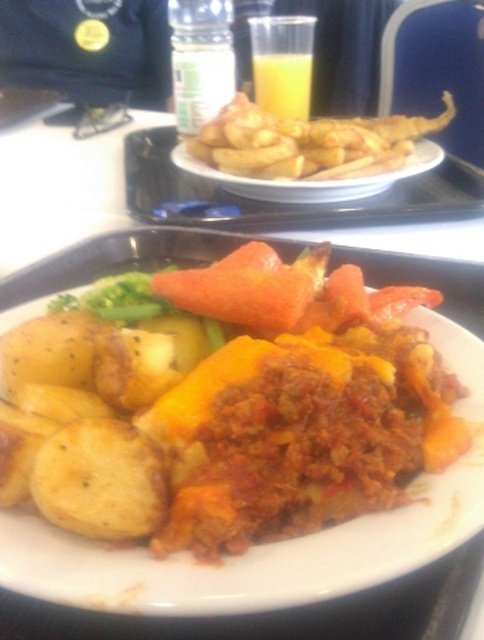
Question: Which object is positioned farthest from the orange smooth carrot at center?

Choices:
 (A) golden crispy fries at upper center
 (B) yellow matte potatoes at lower left

Answer: (A)

Question: Is golden crispy fries at upper center smaller than translucent plastic cup at upper center?

Choices:
 (A) yes
 (B) no

Answer: (B)

Question: Which object is farther from the camera taking this photo?

Choices:
 (A) translucent plastic cup at upper center
 (B) yellow matte potatoes at lower left
 (C) golden crispy fries at upper center
 (D) yellow matte potato at lower left

Answer: (A)

Question: Is golden crispy fries at upper center bigger than yellow matte potato at lower left?

Choices:
 (A) no
 (B) yes

Answer: (B)

Question: Among these points, which one is farthest from the camera?

Choices:
 (A) click(141, 529)
 (B) click(257, 65)

Answer: (B)

Question: Can you confirm if yellow matte potatoes at lower left is bigger than translucent plastic cup at upper center?

Choices:
 (A) no
 (B) yes

Answer: (B)